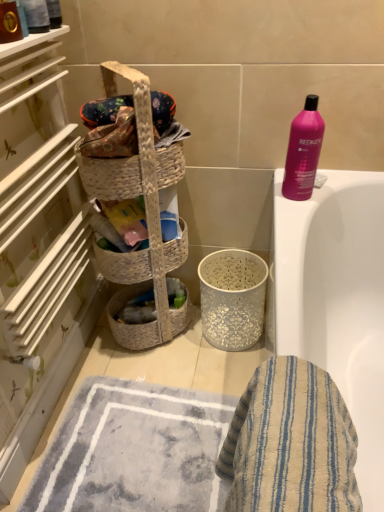
At what (x,y) coordinates should I click in order to perform the action: click on vacant area on top of gray textured bath mat at lower center (from a real-world perspective). Please return your answer as a coordinate pair (x, y). Looking at the image, I should click on (136, 448).